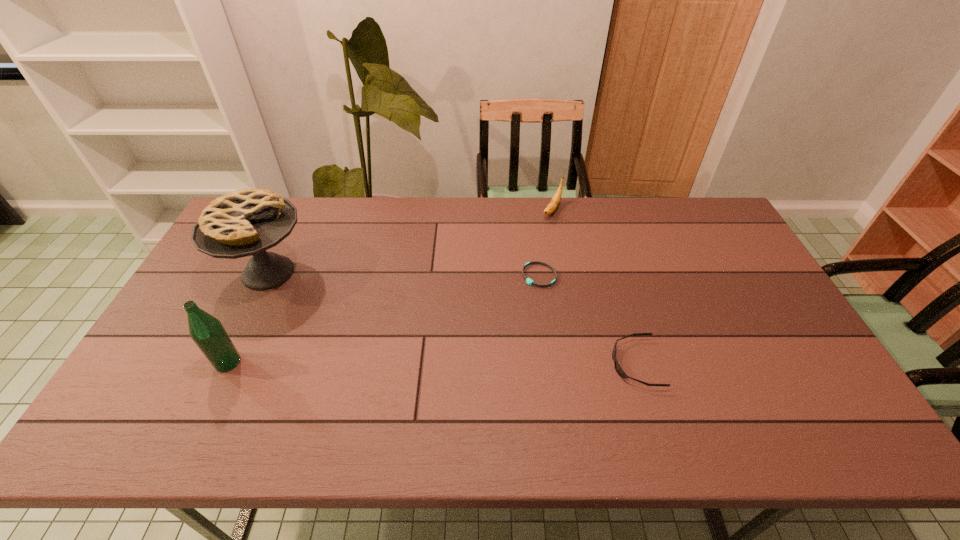
Locate an element on the screen. vacant space on the desktop that is between the bottle and the fourth tallest object and is positioned on the buckle of the wristband is located at coordinates (460, 363).

Find the location of a particular element. vacant spot on the desktop that is between the bottle and the rightmost object and is positioned on the peel of the third tallest object from the top is located at coordinates (454, 363).

The image size is (960, 540). What are the coordinates of `vacant space on the desktop that is between the bottle and the sunglasses and is positioned on the cut side of the pie` in the screenshot? It's located at (392, 363).